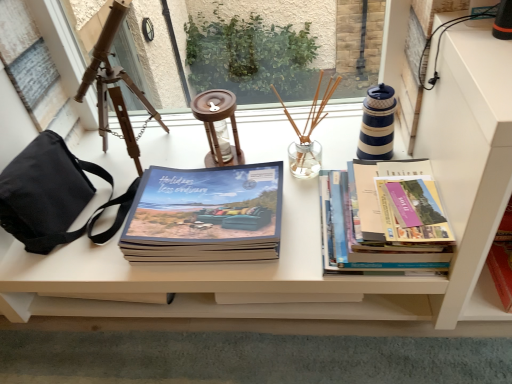
Question: Could you tell me if matte blue book at center, placed as the third book when sorted from right to left, is facing black canvas bag at left?

Choices:
 (A) yes
 (B) no

Answer: (B)

Question: Would you say black canvas bag at left is part of matte blue book at center, the first book in the left-to-right sequence,'s contents?

Choices:
 (A) yes
 (B) no

Answer: (B)

Question: Is matte blue book at center, the first book in the left-to-right sequence, behind black canvas bag at left?

Choices:
 (A) yes
 (B) no

Answer: (A)

Question: Considering the relative sizes of matte blue book at center, the first book in the left-to-right sequence, and black canvas bag at left in the image provided, is matte blue book at center, the first book in the left-to-right sequence, bigger than black canvas bag at left?

Choices:
 (A) yes
 (B) no

Answer: (B)

Question: Looking at their shapes, would you say wooden tripod at left is wider or thinner than hardcover books at right, arranged as the 2th book when viewed from the left?

Choices:
 (A) thin
 (B) wide

Answer: (A)

Question: From their relative heights in the image, would you say wooden tripod at left is taller or shorter than hardcover books at right, arranged as the 2th book when viewed from the left?

Choices:
 (A) tall
 (B) short

Answer: (A)

Question: In terms of size, does wooden tripod at left appear bigger or smaller than hardcover books at right, which is counted as the 2th book, starting from the right?

Choices:
 (A) small
 (B) big

Answer: (B)

Question: From the image's perspective, is wooden tripod at left above or below hardcover books at right, which is counted as the 2th book, starting from the right?

Choices:
 (A) below
 (B) above

Answer: (B)

Question: From a real-world perspective, is matte blue book at center, placed as the third book when sorted from right to left, physically located above or below hardcover books at right, which is counted as the 2th book, starting from the right?

Choices:
 (A) above
 (B) below

Answer: (B)

Question: Is matte blue book at center, placed as the third book when sorted from right to left, bigger or smaller than hardcover books at right, arranged as the 2th book when viewed from the left?

Choices:
 (A) small
 (B) big

Answer: (B)

Question: From the image's perspective, is matte blue book at center, placed as the third book when sorted from right to left, positioned above or below hardcover books at right, arranged as the 2th book when viewed from the left?

Choices:
 (A) below
 (B) above

Answer: (A)

Question: Is matte blue book at center, placed as the third book when sorted from right to left, spatially inside hardcover books at right, arranged as the 2th book when viewed from the left, or outside of it?

Choices:
 (A) inside
 (B) outside

Answer: (B)

Question: Is point (364, 261) closer or farther from the camera than point (505, 210)?

Choices:
 (A) closer
 (B) farther

Answer: (A)

Question: Considering the relative positions of hardcover books at right, arranged as the 2th book when viewed from the left, and hardcover book at lower right, positioned as the third book in left-to-right order, in the image provided, is hardcover books at right, arranged as the 2th book when viewed from the left, to the left or to the right of hardcover book at lower right, positioned as the third book in left-to-right order,?

Choices:
 (A) left
 (B) right

Answer: (A)